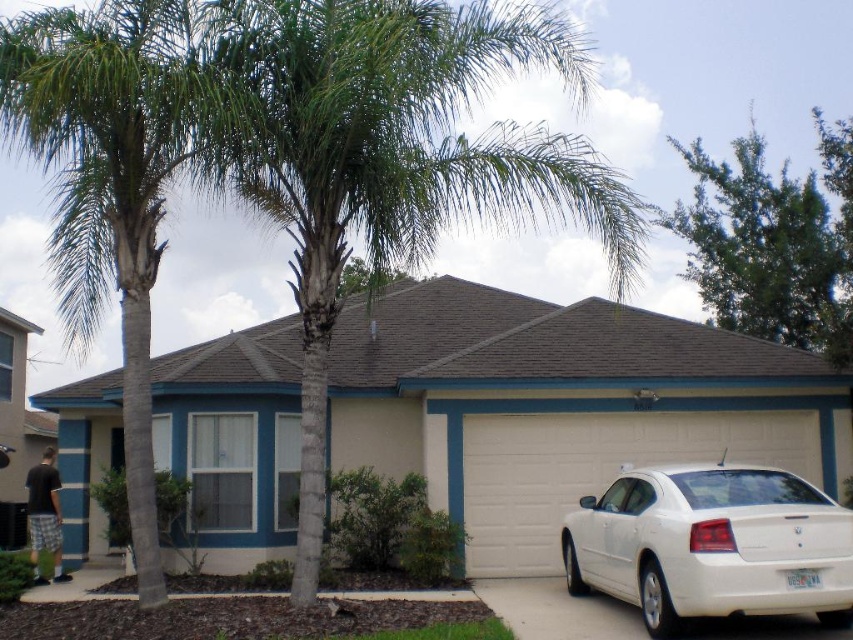
Is point (264, 390) in front of point (97, 152)?

No.

Who is positioned more to the left, white textured garage door at center or green leafy palm tree at left?

green leafy palm tree at left is more to the left.

Is point (521, 561) positioned before point (157, 125)?

No, it is behind (157, 125).

Image resolution: width=853 pixels, height=640 pixels. I want to click on white textured garage door at center, so click(561, 404).

Does green leafy palm tree at center have a smaller size compared to green leafy palm tree at left?

Indeed, green leafy palm tree at center has a smaller size compared to green leafy palm tree at left.

Which is in front, point (561, 176) or point (115, 88)?

Positioned in front is point (115, 88).

Identify the location of green leafy palm tree at center. The width and height of the screenshot is (853, 640). (386, 156).

Who is positioned more to the right, green leafy palm tree at center or green leafy tree at upper right?

green leafy tree at upper right

Does green leafy palm tree at center have a greater height compared to green leafy tree at upper right?

Yes, green leafy palm tree at center is taller than green leafy tree at upper right.

Who is more forward, (230,0) or (700,276)?

Point (230,0)

Where is `green leafy palm tree at center`? Image resolution: width=853 pixels, height=640 pixels. green leafy palm tree at center is located at coordinates (386, 156).